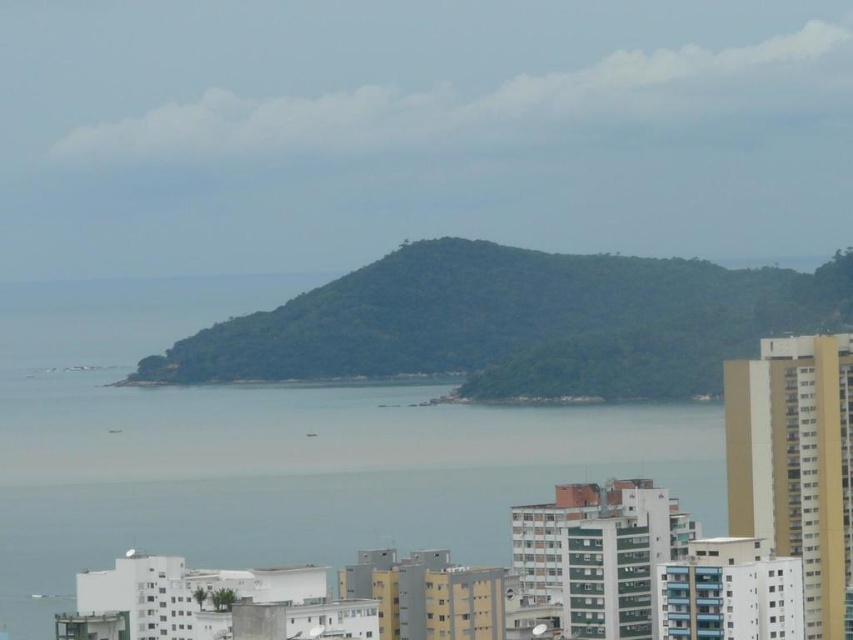
Between point (16, 467) and point (181, 348), which one is positioned behind?

The point (16, 467) is more distant.

Where is `clear blue water at center`? The height and width of the screenshot is (640, 853). clear blue water at center is located at coordinates [271, 451].

Where is `clear blue water at center`? The width and height of the screenshot is (853, 640). clear blue water at center is located at coordinates (271, 451).